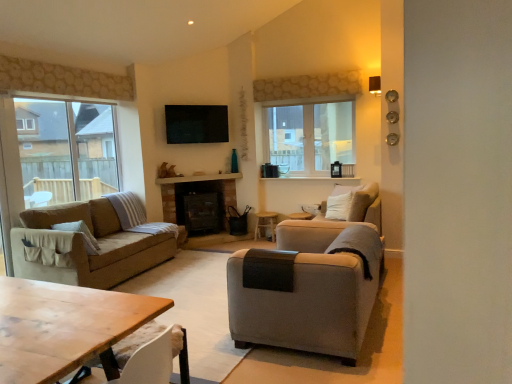
Question: Does transparent glass screen door at left have a lesser height compared to wooden table at lower left?

Choices:
 (A) yes
 (B) no

Answer: (B)

Question: From a real-world perspective, is transparent glass screen door at left on wooden table at lower left?

Choices:
 (A) yes
 (B) no

Answer: (A)

Question: Is transparent glass screen door at left looking in the opposite direction of wooden table at lower left?

Choices:
 (A) no
 (B) yes

Answer: (A)

Question: Can you confirm if transparent glass screen door at left is thinner than wooden table at lower left?

Choices:
 (A) no
 (B) yes

Answer: (B)

Question: From the image's perspective, would you say transparent glass screen door at left is shown under wooden table at lower left?

Choices:
 (A) yes
 (B) no

Answer: (B)

Question: Based on their positions, is wooden table at lower left located to the left or right of wooden side table at center?

Choices:
 (A) left
 (B) right

Answer: (A)

Question: Is wooden table at lower left wider or thinner than wooden side table at center?

Choices:
 (A) wide
 (B) thin

Answer: (A)

Question: From the image's perspective, relative to wooden side table at center, is wooden table at lower left above or below?

Choices:
 (A) below
 (B) above

Answer: (A)

Question: Considering the positions of wooden table at lower left and wooden side table at center in the image, is wooden table at lower left bigger or smaller than wooden side table at center?

Choices:
 (A) big
 (B) small

Answer: (A)

Question: Considering the positions of clear glass window at left, positioned as the first window in left-to-right order, and transparent glass screen door at left in the image, is clear glass window at left, positioned as the first window in left-to-right order, taller or shorter than transparent glass screen door at left?

Choices:
 (A) tall
 (B) short

Answer: (A)

Question: Choose the correct answer: Is clear glass window at left, positioned as the first window in left-to-right order, inside transparent glass screen door at left or outside it?

Choices:
 (A) outside
 (B) inside

Answer: (A)

Question: From the image's perspective, is clear glass window at left, positioned as the first window in left-to-right order, positioned above or below transparent glass screen door at left?

Choices:
 (A) above
 (B) below

Answer: (A)

Question: Is point (64, 107) closer or farther from the camera than point (13, 122)?

Choices:
 (A) farther
 (B) closer

Answer: (A)

Question: From their relative heights in the image, would you say transparent glass screen door at left is taller or shorter than light gray fabric armchair at right?

Choices:
 (A) tall
 (B) short

Answer: (A)

Question: Does point (19, 177) appear closer or farther from the camera than point (286, 244)?

Choices:
 (A) farther
 (B) closer

Answer: (A)